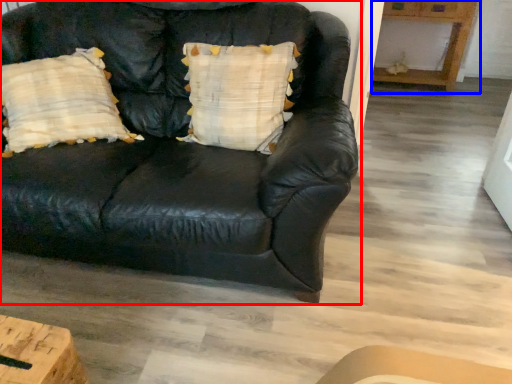
Question: Which object appears farthest to the camera in this image, studio couch (highlighted by a red box) or table (highlighted by a blue box)?

Choices:
 (A) studio couch
 (B) table

Answer: (B)